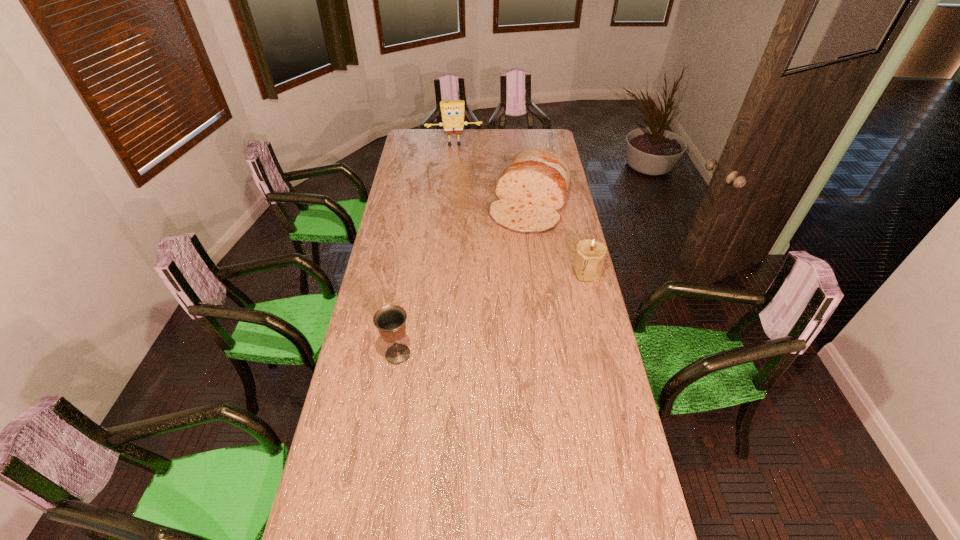
The width and height of the screenshot is (960, 540). In order to click on vacant space situated at the sliced end of the second farthest object in this screenshot , I will do `click(499, 286)`.

Image resolution: width=960 pixels, height=540 pixels. Find the location of `vacant region located at the sliced end of the second farthest object`. vacant region located at the sliced end of the second farthest object is located at coordinates (510, 261).

Where is `free space located at the sliced end of the second farthest object`? free space located at the sliced end of the second farthest object is located at coordinates [500, 283].

You are a GUI agent. You are given a task and a screenshot of the screen. Output one action in this format:
    pyautogui.click(x=<x>, y=<y>)
    Task: Click on the object at the far edge
    
    Given the screenshot: What is the action you would take?
    click(452, 112)

The width and height of the screenshot is (960, 540). In order to click on chalice located in the left edge section of the desktop in this screenshot , I will do `click(390, 320)`.

Find the location of a particular element. This screenshot has width=960, height=540. sponge that is at the left edge is located at coordinates (452, 112).

Find the location of a particular element. candle_holder positioned at the right edge is located at coordinates (590, 254).

The width and height of the screenshot is (960, 540). In order to click on bread present at the right edge in this screenshot , I will do `click(532, 188)`.

This screenshot has height=540, width=960. I want to click on object present at the far left corner, so click(452, 112).

In the image, there is a desktop. Find the location of `vacant space at the far edge`. vacant space at the far edge is located at coordinates (514, 141).